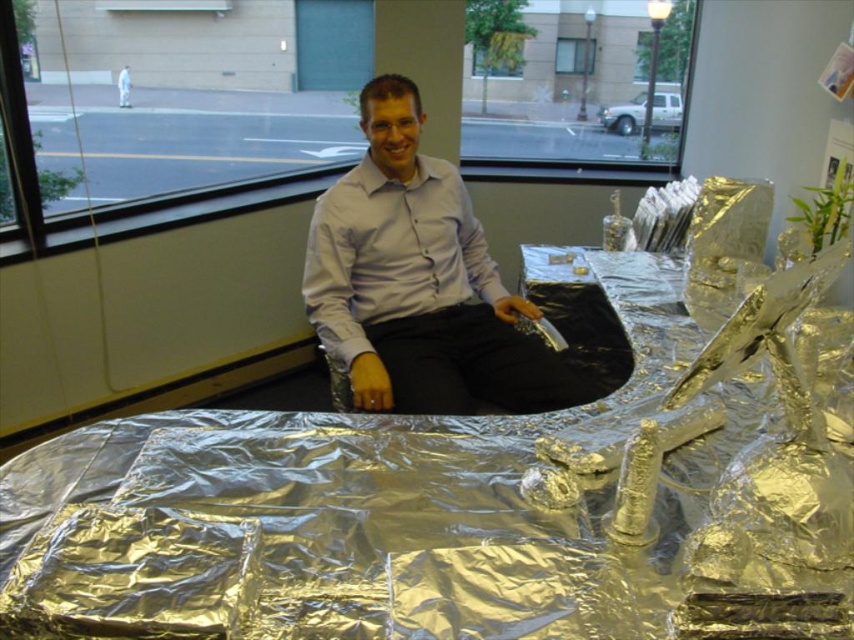
You are organizing a party and need to place a large centerpiece on the silver reflective table at center. Considering the size of the matte white shirt at center, will the table have enough space to accommodate the centerpiece?

The silver reflective table at center is bigger than the matte white shirt at center, so there should be enough space to place the large centerpiece on the table.

You are standing in the room where the man is seated. If you want to place a new object exactly where the silver reflective table at center is located, what coordinates should you aim for?

The silver reflective table at center is located at coordinates point (457, 508), so you should aim for those coordinates to place the new object there.

You are a photographer setting up for a portrait shoot. You notice the silver reflective table at center and the matte white shirt at center in the scene. Which object is positioned lower in the frame?

The silver reflective table at center is located below the matte white shirt at center, so it is positioned lower in the frame.